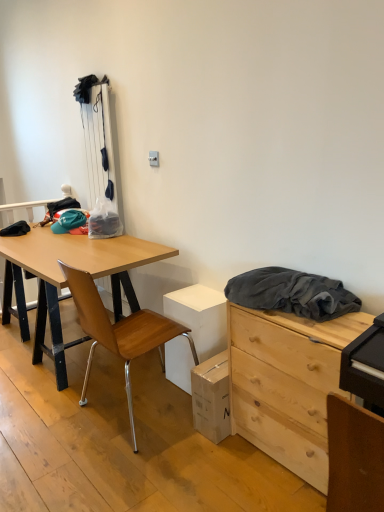
Where is `blank area to the left of wooden at left`? Image resolution: width=384 pixels, height=512 pixels. blank area to the left of wooden at left is located at coordinates (39, 413).